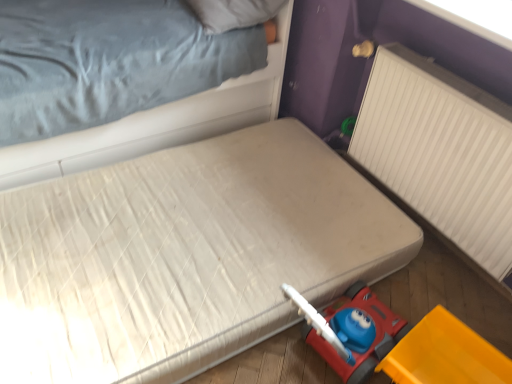
Question: Should I look upward or downward to see white fabric bed at upper left, marked as the 1th bed in a top-to-bottom arrangement?

Choices:
 (A) down
 (B) up

Answer: (B)

Question: From a real-world perspective, is white soft pillow at upper center on top of white quilted mattress at lower right, marked as the 2th bed in a top-to-bottom arrangement?

Choices:
 (A) no
 (B) yes

Answer: (B)

Question: Is white soft pillow at upper center at the right side of white quilted mattress at lower right, marked as the 2th bed in a top-to-bottom arrangement?

Choices:
 (A) no
 (B) yes

Answer: (B)

Question: Is white soft pillow at upper center aimed at white quilted mattress at lower right, marked as the 2th bed in a top-to-bottom arrangement?

Choices:
 (A) no
 (B) yes

Answer: (A)

Question: Is white soft pillow at upper center outside of white quilted mattress at lower right, the first bed when ordered from bottom to top?

Choices:
 (A) yes
 (B) no

Answer: (A)

Question: Does white soft pillow at upper center have a lesser height compared to white quilted mattress at lower right, marked as the 2th bed in a top-to-bottom arrangement?

Choices:
 (A) no
 (B) yes

Answer: (B)

Question: From a real-world perspective, is white soft pillow at upper center under white quilted mattress at lower right, the first bed when ordered from bottom to top?

Choices:
 (A) yes
 (B) no

Answer: (B)

Question: Can you confirm if white ribbed radiator at right is smaller than yellow plastic toy car at lower right?

Choices:
 (A) no
 (B) yes

Answer: (A)

Question: From a real-world perspective, is white ribbed radiator at right physically below yellow plastic toy car at lower right?

Choices:
 (A) yes
 (B) no

Answer: (B)

Question: Can you confirm if white ribbed radiator at right is wider than yellow plastic toy car at lower right?

Choices:
 (A) no
 (B) yes

Answer: (A)

Question: Is white ribbed radiator at right turned away from yellow plastic toy car at lower right?

Choices:
 (A) yes
 (B) no

Answer: (B)

Question: Is white ribbed radiator at right placed right next to yellow plastic toy car at lower right?

Choices:
 (A) no
 (B) yes

Answer: (A)

Question: Could you tell me if white ribbed radiator at right is facing yellow plastic toy car at lower right?

Choices:
 (A) no
 (B) yes

Answer: (B)

Question: Does white soft pillow at upper center have a smaller size compared to white fabric bed at upper left, marked as the 1th bed in a top-to-bottom arrangement?

Choices:
 (A) yes
 (B) no

Answer: (A)